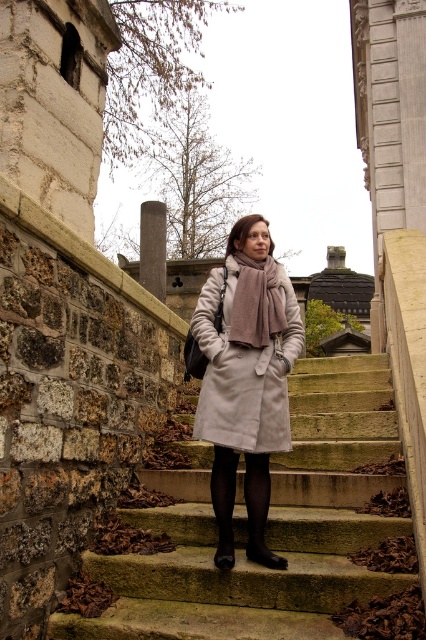
You are a photographer standing at the base of the smooth stone stairs at center. You want to take a photo of the entire staircase without moving your position. Given that your camera has a maximum zoom range of 100 feet, will you be able to capture the entire staircase in one shot?

The smooth stone stairs at center are 47.35 feet away from the camera. Since the camera can zoom up to 100 feet, which is greater than the distance to the stairs, you can capture the entire staircase in one shot without moving your position.

You are a fashion designer observing a person in a cemetery. You notice the black tights at center and brown woolen scarf at center. Which clothing item is shorter in height?

The black tights at center has a lesser height compared to the brown woolen scarf at center, so the black tights at center is shorter in height.

You are standing at point (267, 465) and want to move to point (284, 460). Is the destination point behind you or in front of you?

The destination point (284, 460) is behind you because it is located behind point (267, 465) where you are standing.